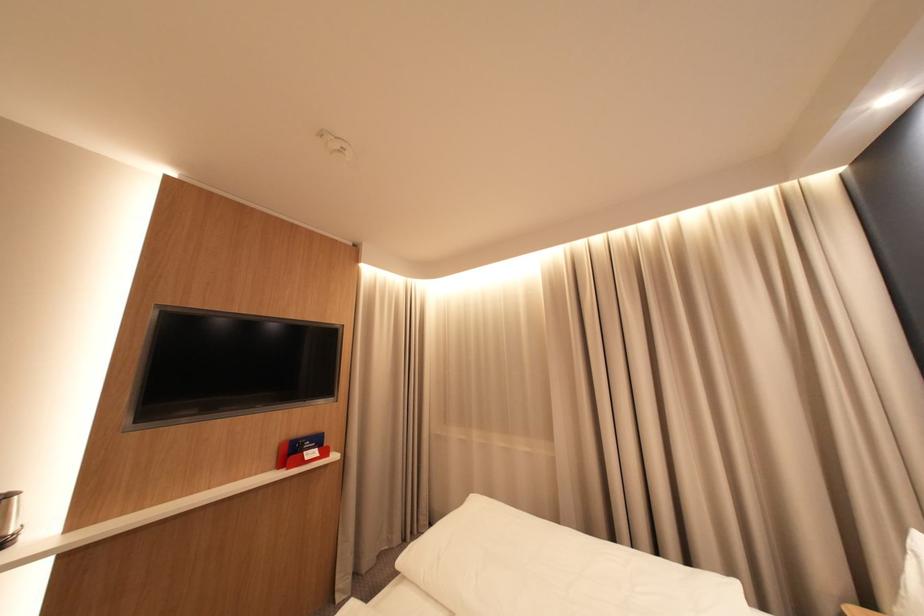
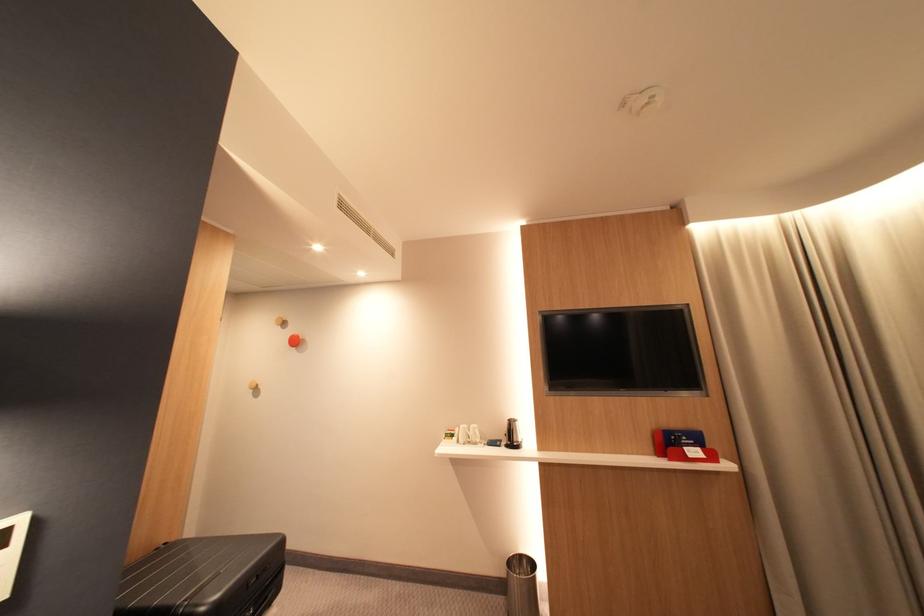
Question: How did the camera likely rotate?

Choices:
 (A) Left
 (B) Right
 (C) Up
 (D) Down

Answer: (A)